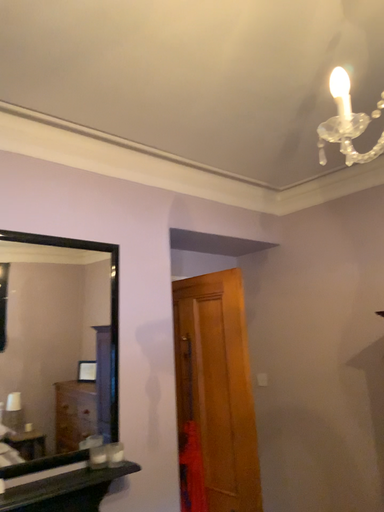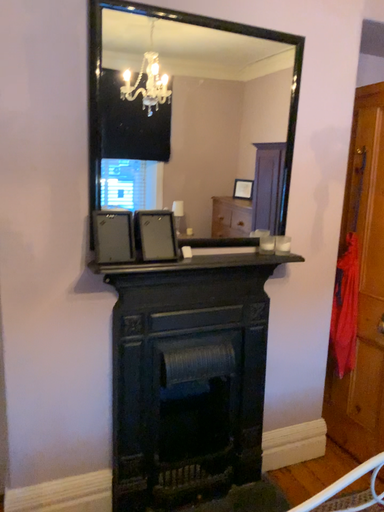
Question: Which way did the camera rotate in the video?

Choices:
 (A) rotated left
 (B) rotated right

Answer: (A)